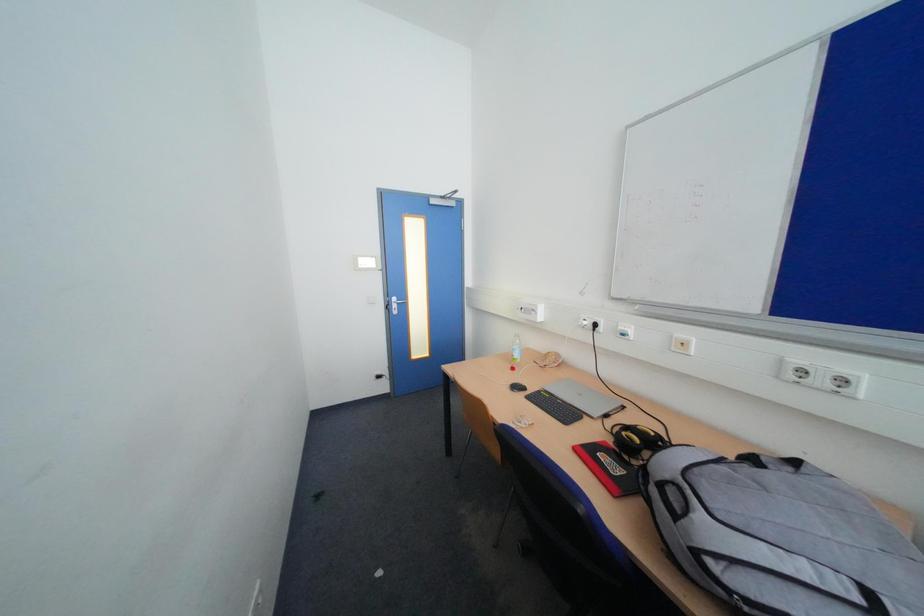
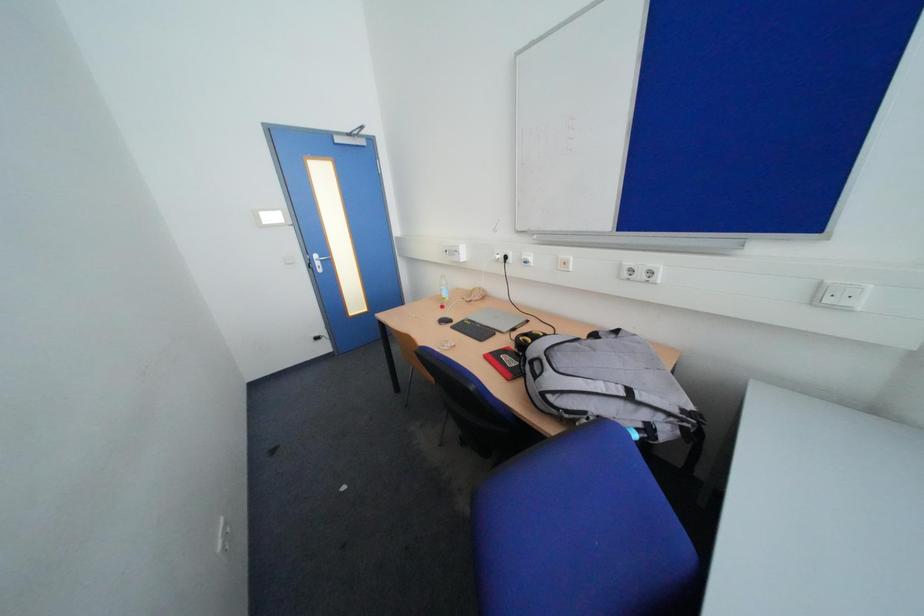
Which direction would the cameraman need to move to produce the second image?

The cameraman moved toward right, backward.